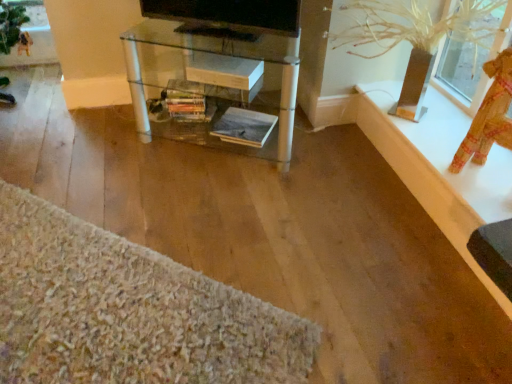
The height and width of the screenshot is (384, 512). I want to click on free spot below textured fabric doll at upper right (from a real-world perspective), so click(480, 170).